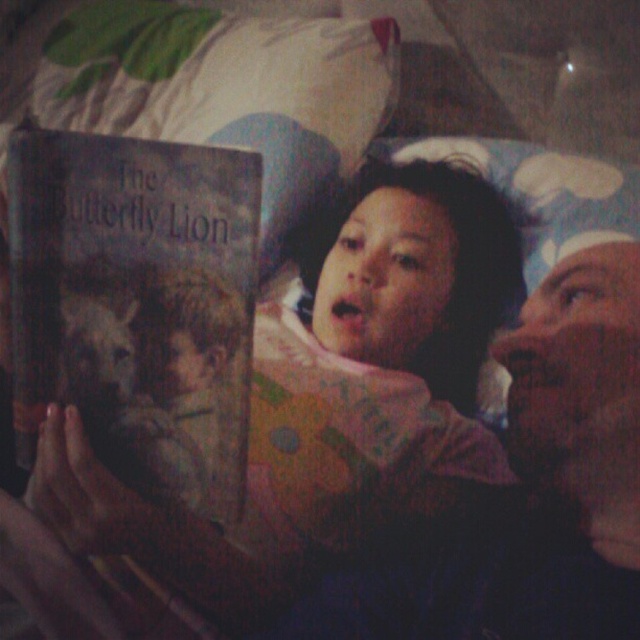
You are trying to decide which pillow to use as a headrest while reading the book. Which one is bigger between the white fabric pillow at upper center and the fluffy white pillow at upper center?

The white fabric pillow at upper center is larger in size than the fluffy white pillow at upper center, so it would be the better choice for a headrest.

You are a reader trying to place the hardcover book at center back onto the shelf. The shelf has a space that is to the left of the white fabric pillow at upper center. Will the book fit in that space?

The hardcover book at center is to the right of white fabric pillow at upper center, so the space to the left of the white fabric pillow at upper center is not where the book is currently placed. Therefore, the book cannot fit in that space unless moved from its current position.